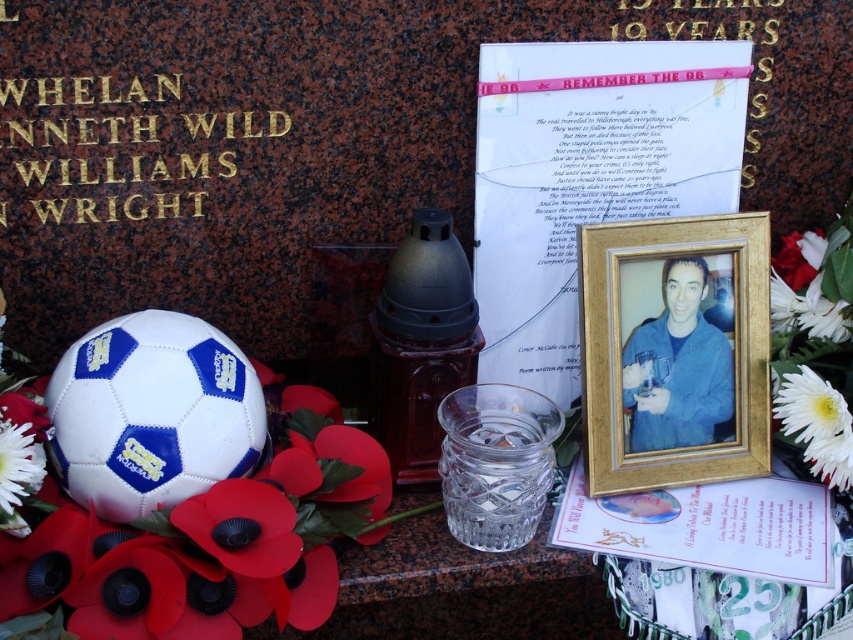
You are standing in front of the memorial setup against the dark reddish brown stone background. You see two points marked as point (x=136, y=579) and point (x=712, y=275). Which point is closer to you?

Point (x=136, y=579) is in front of point (x=712, y=275), so it is closer to you.